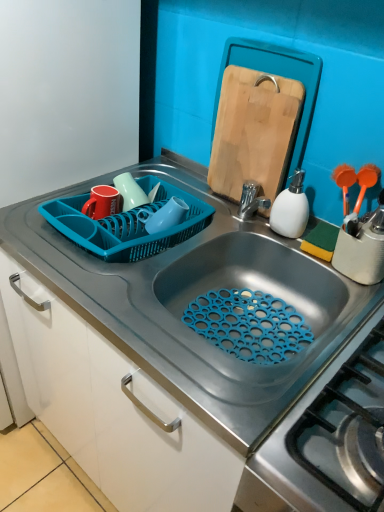
Question: Based on their sizes in the image, would you say white matte soap dispenser at right is bigger or smaller than matte ceramic mugs at upper center, which appears as the first tableware when viewed from the right?

Choices:
 (A) small
 (B) big

Answer: (B)

Question: Would you say white matte soap dispenser at right is to the left or to the right of matte ceramic mugs at upper center, placed as the second tableware when sorted from left to right, in the picture?

Choices:
 (A) right
 (B) left

Answer: (A)

Question: Based on their relative distances, which object is farther from the wooden cutting board at upper right?

Choices:
 (A) matte ceramic mugs at upper center, which appears as the first tableware when viewed from the right
 (B) teal plastic dish rack at upper left
 (C) matte red mug at upper left, the 2th tableware positioned from the right
 (D) white matte soap dispenser at right
 (E) smooth gray countertop at center

Answer: (E)

Question: Considering the real-world distances, which object is farthest from the teal plastic dish rack at upper left?

Choices:
 (A) matte ceramic mugs at upper center, placed as the second tableware when sorted from left to right
 (B) matte red mug at upper left, the 2th tableware positioned from the right
 (C) smooth gray countertop at center
 (D) wooden cutting board at upper right
 (E) white matte soap dispenser at right

Answer: (E)